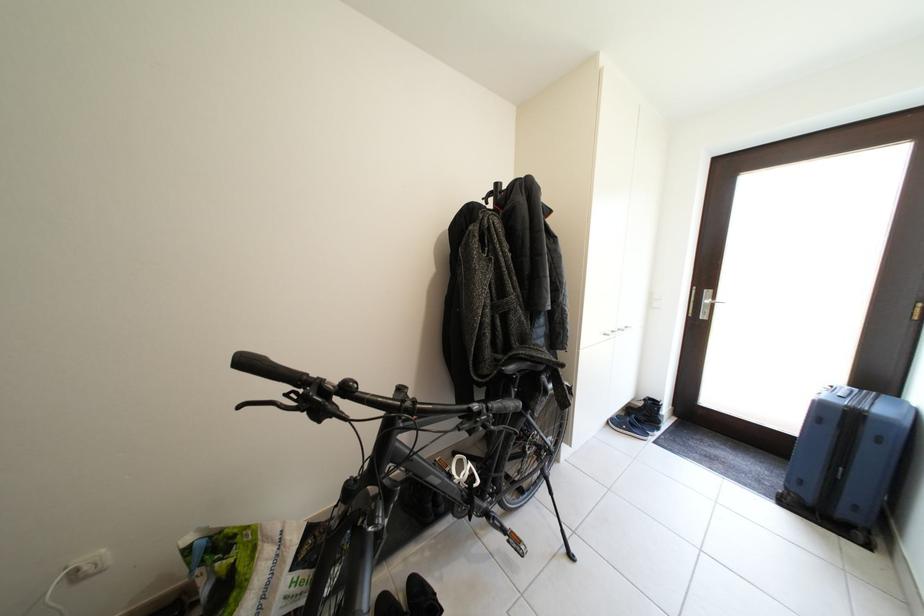
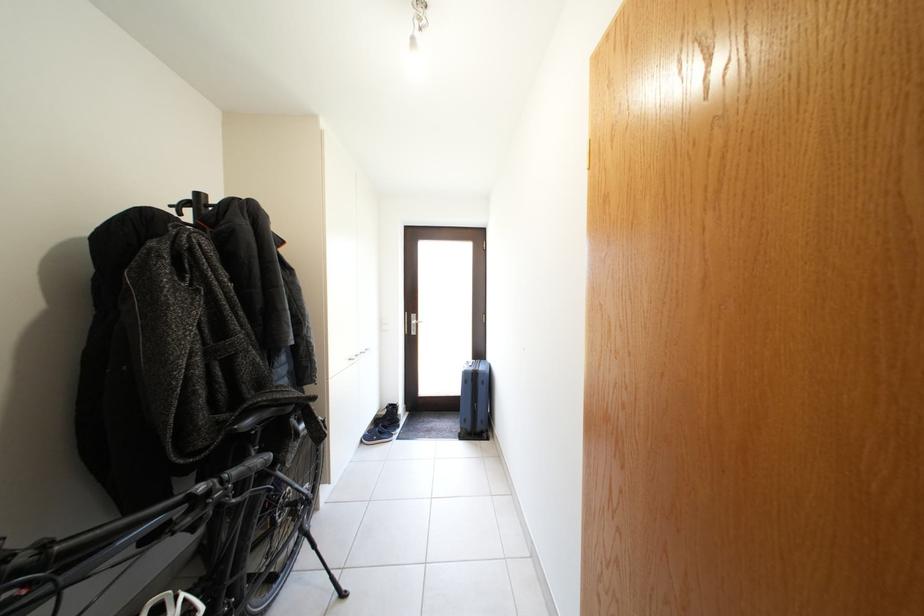
Find the pixel in the second image that matches the point at 541,362 in the first image.

(286, 406)